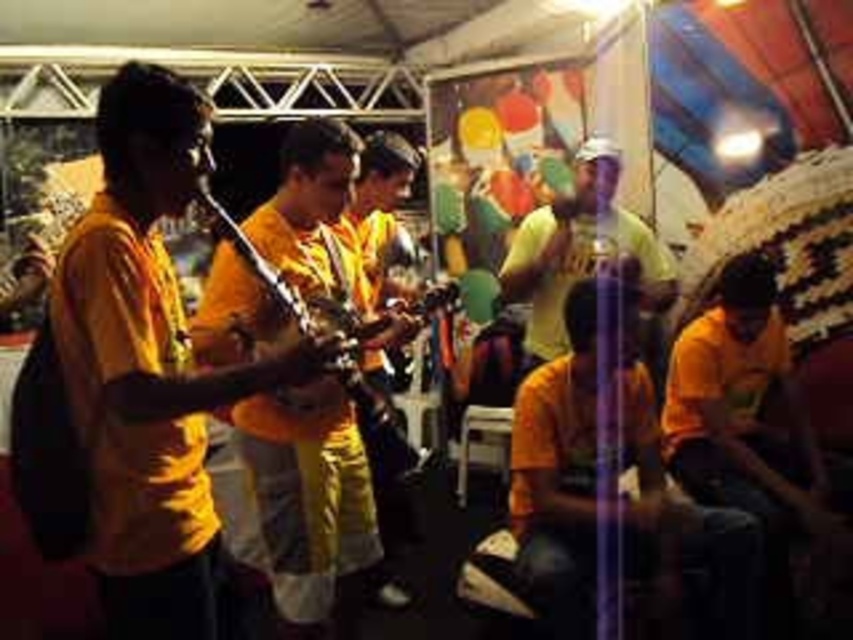
Question: Estimate the real-world distances between objects in this image. Which object is farther from the yellow matte shirt at left?

Choices:
 (A) metallic gold instrument at center
 (B) matte yellow shirt at center

Answer: (B)

Question: Among these objects, which one is farthest from the camera?

Choices:
 (A) yellow matte shirt at left
 (B) matte yellow shirt at center

Answer: (B)

Question: Can you confirm if yellow matte shirt at left is thinner than metallic gold instrument at center?

Choices:
 (A) yes
 (B) no

Answer: (B)

Question: Estimate the real-world distances between objects in this image. Which object is farther from the yellow matte shirt at left?

Choices:
 (A) matte yellow shirt at center
 (B) metallic gold instrument at center

Answer: (A)

Question: Does yellow matte shirt at left appear on the right side of metallic gold instrument at center?

Choices:
 (A) no
 (B) yes

Answer: (A)

Question: Can you confirm if matte yellow shirt at center is positioned above metallic gold instrument at center?

Choices:
 (A) no
 (B) yes

Answer: (B)